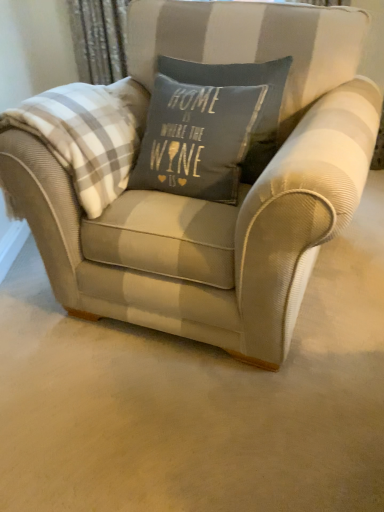
The height and width of the screenshot is (512, 384). What do you see at coordinates (248, 193) in the screenshot? I see `textured beige armchair at center` at bounding box center [248, 193].

Locate an element on the screen. The image size is (384, 512). textured beige armchair at center is located at coordinates 248,193.

This screenshot has width=384, height=512. I want to click on white plaid blanket at left, so click(x=88, y=134).

Describe the element at coordinates (88, 134) in the screenshot. I see `white plaid blanket at left` at that location.

This screenshot has width=384, height=512. I want to click on textured beige armchair at center, so tap(248, 193).

Which object is positioned more to the left, white plaid blanket at left or textured beige armchair at center?

white plaid blanket at left is more to the left.

Is the position of white plaid blanket at left less distant than that of textured beige armchair at center?

No, it is behind textured beige armchair at center.

Does point (119, 141) lie behind point (51, 268)?

No, (119, 141) is closer to viewer.

Consider the image. From the image's perspective, which object appears higher, white plaid blanket at left or textured beige armchair at center?

white plaid blanket at left is shown above in the image.

From a real-world perspective, is white plaid blanket at left positioned over textured beige armchair at center based on gravity?

Correct, in the physical world, white plaid blanket at left is higher than textured beige armchair at center.

Does white plaid blanket at left have a lesser width compared to textured beige armchair at center?

Correct, the width of white plaid blanket at left is less than that of textured beige armchair at center.

Looking at this image, considering the sizes of white plaid blanket at left and textured beige armchair at center in the image, is white plaid blanket at left taller or shorter than textured beige armchair at center?

In the image, white plaid blanket at left appears to be shorter than textured beige armchair at center.

Based on their sizes in the image, would you say white plaid blanket at left is bigger or smaller than textured beige armchair at center?

Considering their sizes, white plaid blanket at left takes up less space than textured beige armchair at center.

Is textured beige armchair at center a part of white plaid blanket at left?

No, textured beige armchair at center is not a part of white plaid blanket at left.

Is the surface of white plaid blanket at left in direct contact with textured beige armchair at center?

white plaid blanket at left and textured beige armchair at center are clearly separated.

Is white plaid blanket at left looking in the opposite direction of textured beige armchair at center?

Correct, white plaid blanket at left is looking away from textured beige armchair at center.

How different are the orientations of white plaid blanket at left and textured beige armchair at center in degrees?

There is a 6.75-degree angle between the facing directions of white plaid blanket at left and textured beige armchair at center.

How distant is white plaid blanket at left from textured beige armchair at center?

white plaid blanket at left is 10.83 inches from textured beige armchair at center.

In order to click on chair located underneath the white plaid blanket at left (from a real-world perspective) in this screenshot , I will do `click(248, 193)`.

Which is more to the left, textured beige armchair at center or white plaid blanket at left?

Positioned to the left is white plaid blanket at left.

Is textured beige armchair at center in front of white plaid blanket at left?

Yes, the depth of textured beige armchair at center is less than that of white plaid blanket at left.

Looking at this image, which is farther, [249,346] or [117,165]?

The point [117,165] is farther.

From the image's perspective, is textured beige armchair at center located above or below white plaid blanket at left?

textured beige armchair at center is situated lower than white plaid blanket at left in the image.

From a real-world perspective, which object stands above the other?

white plaid blanket at left, from a real-world perspective.

Considering the sizes of objects textured beige armchair at center and white plaid blanket at left in the image provided, who is thinner, textured beige armchair at center or white plaid blanket at left?

white plaid blanket at left.

Which of these two, textured beige armchair at center or white plaid blanket at left, stands taller?

With more height is textured beige armchair at center.

Between textured beige armchair at center and white plaid blanket at left, which one has smaller size?

With smaller size is white plaid blanket at left.

Which is correct: textured beige armchair at center is inside white plaid blanket at left, or outside of it?

textured beige armchair at center is not inside white plaid blanket at left, it's outside.

Is textured beige armchair at center beside white plaid blanket at left?

textured beige armchair at center is not next to white plaid blanket at left, and they're not touching.

Is textured beige armchair at center turned away from white plaid blanket at left?

No, textured beige armchair at center is not facing away from white plaid blanket at left.

What's the angular difference between textured beige armchair at center and white plaid blanket at left's facing directions?

6.75 degrees separate the facing orientations of textured beige armchair at center and white plaid blanket at left.

Measure the distance between textured beige armchair at center and white plaid blanket at left.

The distance of textured beige armchair at center from white plaid blanket at left is 10.83 inches.

Identify the location of plaid behind the textured beige armchair at center. The image size is (384, 512). (88, 134).

Where is `chair directly beneath the white plaid blanket at left (from a real-world perspective)`? The width and height of the screenshot is (384, 512). chair directly beneath the white plaid blanket at left (from a real-world perspective) is located at coordinates (248, 193).

Locate an element on the screen. Image resolution: width=384 pixels, height=512 pixels. chair below the white plaid blanket at left (from the image's perspective) is located at coordinates (248, 193).